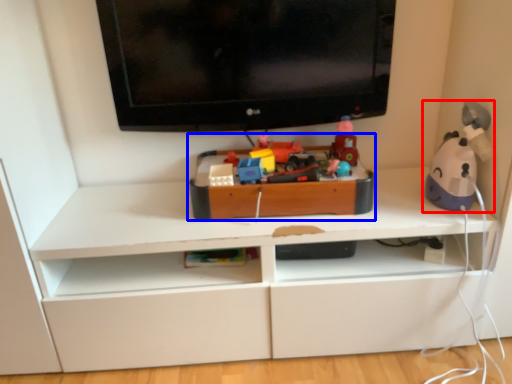
Question: Which object is further to the camera taking this photo, toy (highlighted by a red box) or toy (highlighted by a blue box)?

Choices:
 (A) toy
 (B) toy

Answer: (B)